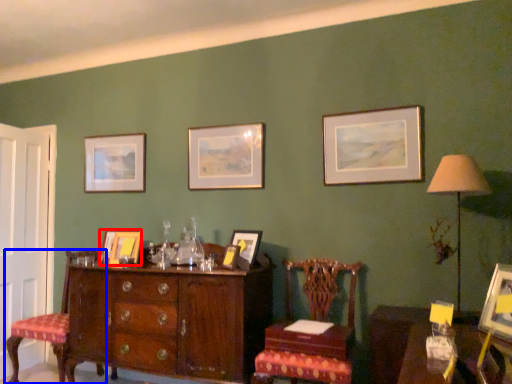
Question: Which of the following is the closest to the observer, picture frame (highlighted by a red box) or chair (highlighted by a blue box)?

Choices:
 (A) picture frame
 (B) chair

Answer: (B)